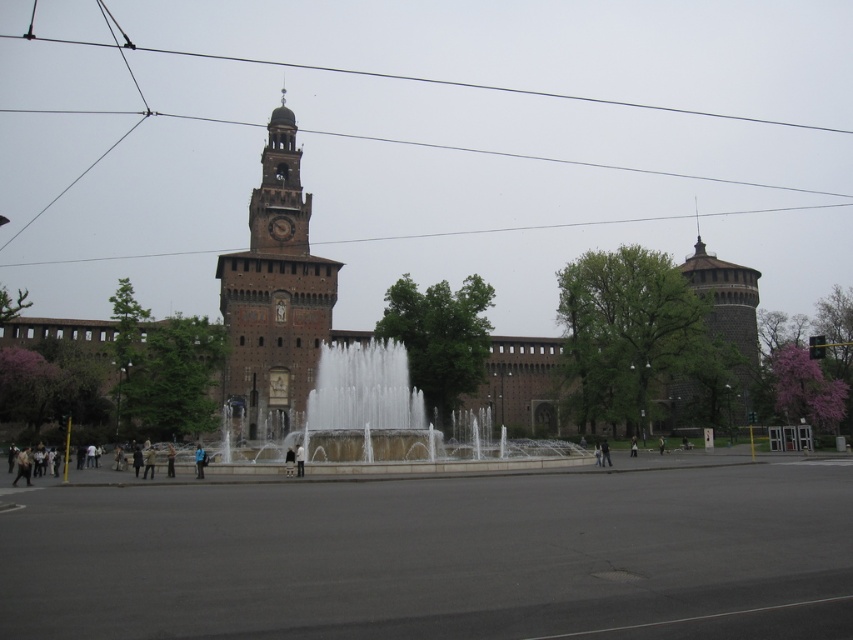
From the picture: Is white stone fountain at center to the left of dark brown stone tower at upper right from the viewer's perspective?

Correct, you'll find white stone fountain at center to the left of dark brown stone tower at upper right.

Looking at this image, which is below, white stone fountain at center or dark brown stone tower at upper right?

white stone fountain at center

This screenshot has height=640, width=853. Describe the element at coordinates (390, 424) in the screenshot. I see `white stone fountain at center` at that location.

Identify the location of white stone fountain at center. The height and width of the screenshot is (640, 853). (390, 424).

Is dark brown stone tower at upper right below metallic wire at upper center?

Yes, dark brown stone tower at upper right is below metallic wire at upper center.

Which is more to the right, dark brown stone tower at upper right or metallic wire at upper center?

From the viewer's perspective, dark brown stone tower at upper right appears more on the right side.

Is point (755, 358) positioned before point (32, 28)?

Yes, it is.

What are the coordinates of `dark brown stone tower at upper right` in the screenshot? It's located at (728, 316).

Which of these two, brown stone clock tower at upper left or metallic wire at upper center, stands taller?

brown stone clock tower at upper left

Between point (282, 100) and point (108, 13), which one is positioned in front?

Point (282, 100) is more forward.

Is point (267, 170) less distant than point (686, 108)?

Yes, point (267, 170) is in front of point (686, 108).

Identify the location of brown stone clock tower at upper left. This screenshot has width=853, height=640. (274, 296).